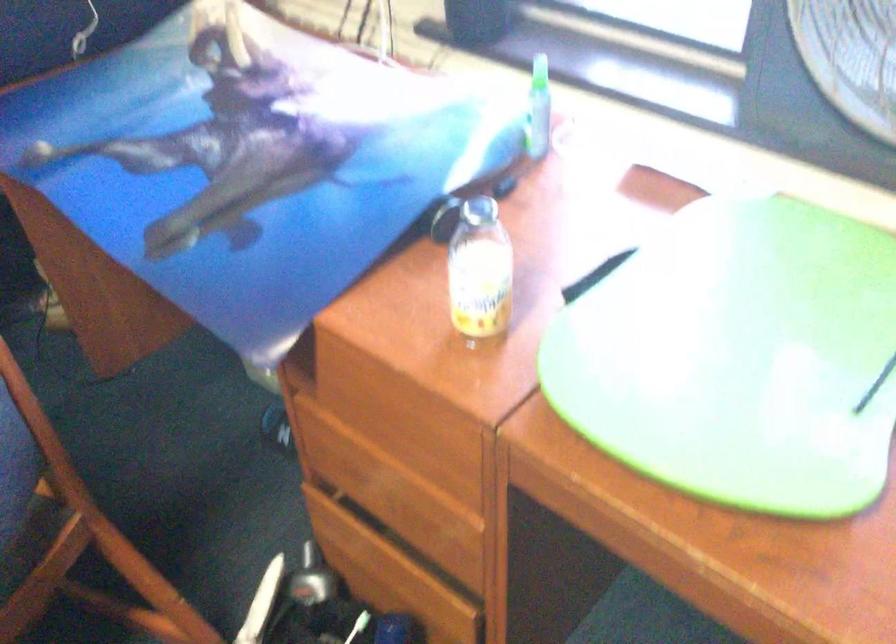
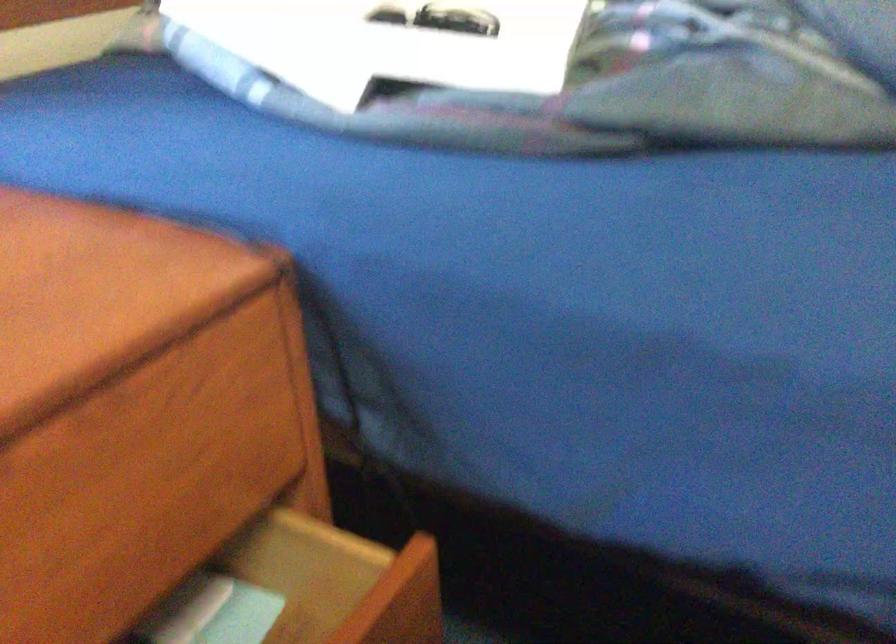
Based on the continuous images, in which direction is the camera rotating?

The camera's rotation is toward right-down.